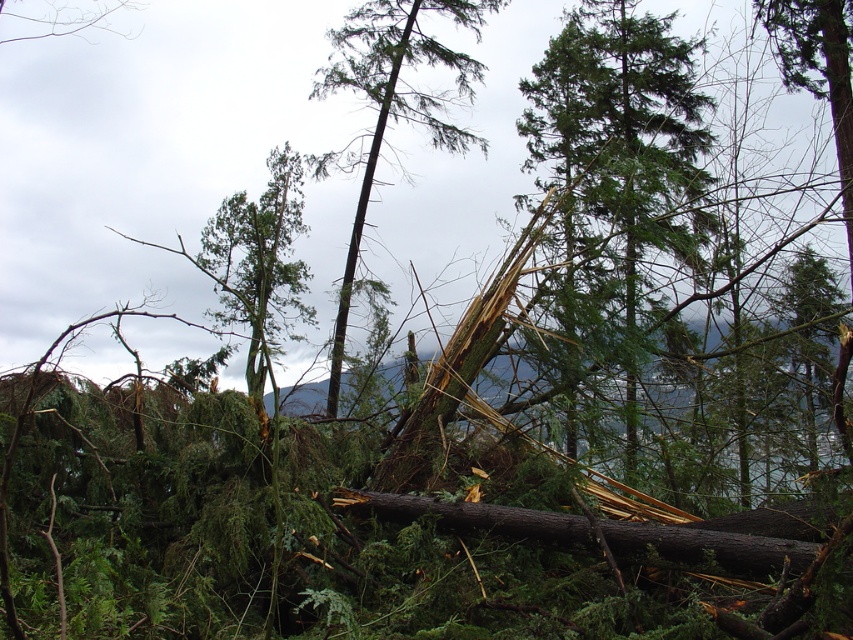
Can you confirm if green needle-like at center is taller than green textured wood at center?

Yes.

Which is behind, point (590, 228) or point (338, 378)?

Positioned behind is point (338, 378).

This screenshot has height=640, width=853. What are the coordinates of `green needle-like at center` in the screenshot? It's located at (618, 170).